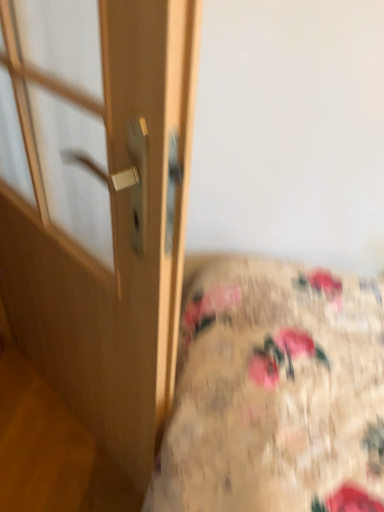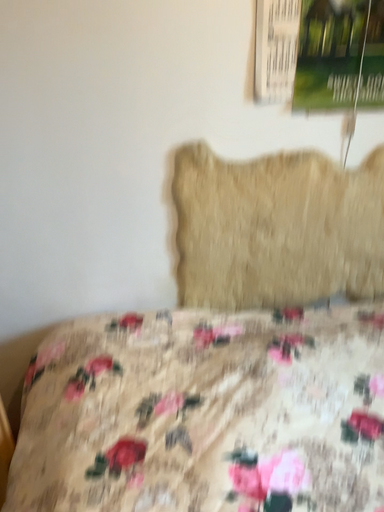
Question: Which way did the camera rotate in the video?

Choices:
 (A) rotated right
 (B) rotated left

Answer: (A)